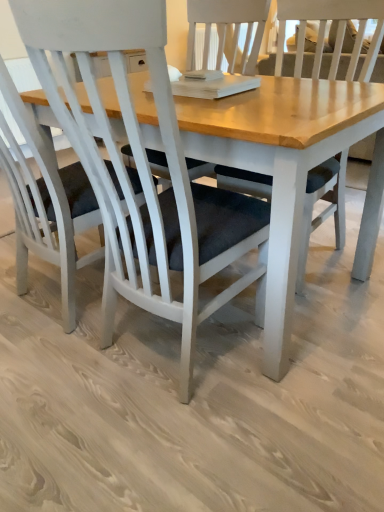
Identify the location of vacant area situated below white matte chair at center, marked as the 1th chair in a left-to-right arrangement (from a real-world perspective). The height and width of the screenshot is (512, 384). (58, 300).